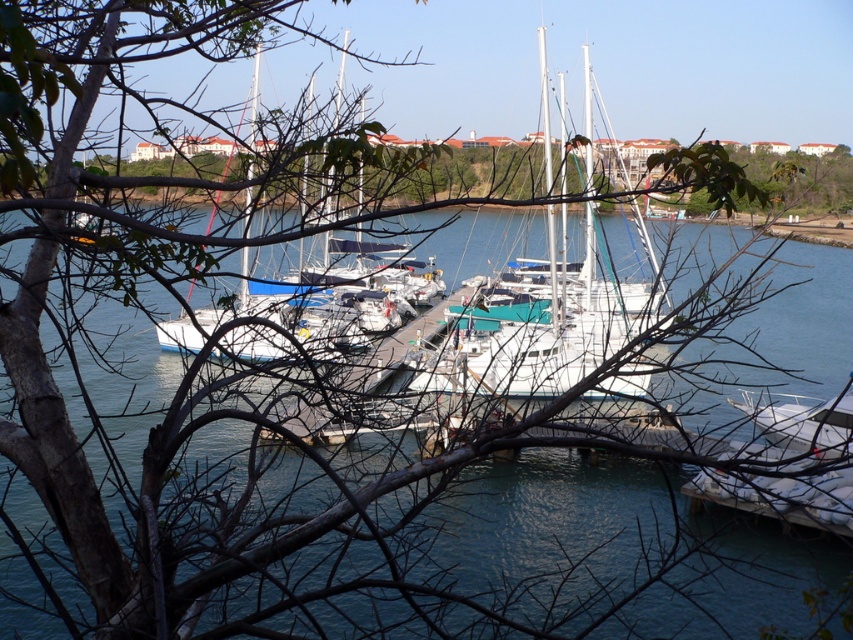
Is white glossy sailboat at center positioned in front of white glossy boat at lower right?

Yes, white glossy sailboat at center is closer to the viewer.

Is point (553, 298) closer to camera compared to point (816, 420)?

No, it is not.

At what (x,y) coordinates should I click in order to perform the action: click on white glossy sailboat at center. Please return your answer as a coordinate pair (x, y). Looking at the image, I should click on [x=560, y=320].